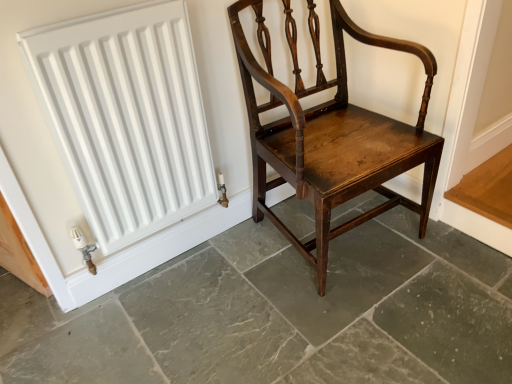
What are the coordinates of `free space below shiny dark wood chair at center (from a real-world perspective)` in the screenshot? It's located at (336, 238).